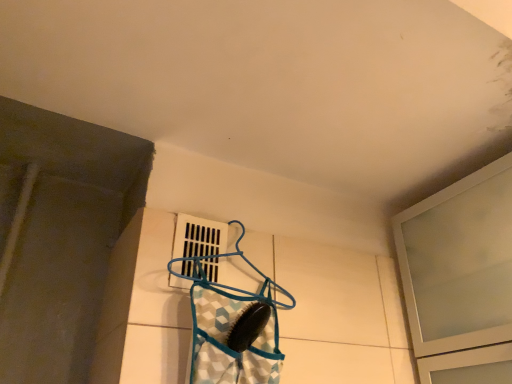
Question: Could blue fabric bag at center be considered to be inside white plastic vent at center, which is the 2th window in right-to-left order?

Choices:
 (A) yes
 (B) no

Answer: (B)

Question: From the image's perspective, would you say white plastic vent at center, which is the 2th window in right-to-left order, is positioned over blue fabric bag at center?

Choices:
 (A) no
 (B) yes

Answer: (B)

Question: Does white plastic vent at center, which is the 2th window in right-to-left order, come in front of blue fabric bag at center?

Choices:
 (A) no
 (B) yes

Answer: (A)

Question: Does white plastic vent at center, the 1th window viewed from the left, have a greater width compared to blue fabric bag at center?

Choices:
 (A) yes
 (B) no

Answer: (B)

Question: Is white plastic vent at center, which is the 2th window in right-to-left order, facing away from blue fabric bag at center?

Choices:
 (A) yes
 (B) no

Answer: (B)

Question: Considering the positions of blue plastic hanger at center and blue fabric bag at center in the image, is blue plastic hanger at center taller or shorter than blue fabric bag at center?

Choices:
 (A) short
 (B) tall

Answer: (B)

Question: Is blue plastic hanger at center inside or outside of blue fabric bag at center?

Choices:
 (A) outside
 (B) inside

Answer: (A)

Question: Considering their positions, is blue plastic hanger at center located in front of or behind blue fabric bag at center?

Choices:
 (A) front
 (B) behind

Answer: (B)

Question: From the image's perspective, is blue plastic hanger at center located above or below blue fabric bag at center?

Choices:
 (A) above
 (B) below

Answer: (A)

Question: From the image's perspective, is blue plastic hanger at center located above or below white plastic vent at center, the 1th window viewed from the left?

Choices:
 (A) above
 (B) below

Answer: (B)

Question: From a real-world perspective, relative to white plastic vent at center, the 1th window viewed from the left, is blue plastic hanger at center vertically above or below?

Choices:
 (A) above
 (B) below

Answer: (A)

Question: Considering the positions of point pyautogui.click(x=208, y=281) and point pyautogui.click(x=181, y=286), is point pyautogui.click(x=208, y=281) closer or farther from the camera than point pyautogui.click(x=181, y=286)?

Choices:
 (A) farther
 (B) closer

Answer: (A)

Question: Looking at the image, does blue plastic hanger at center seem bigger or smaller compared to white plastic vent at center, the 1th window viewed from the left?

Choices:
 (A) small
 (B) big

Answer: (B)

Question: Considering the positions of blue plastic hanger at center and frosted glass cabinet at upper right, the second window when ordered from left to right, in the image, is blue plastic hanger at center taller or shorter than frosted glass cabinet at upper right, the second window when ordered from left to right,?

Choices:
 (A) tall
 (B) short

Answer: (B)

Question: Is point pyautogui.click(x=234, y=244) positioned closer to the camera than point pyautogui.click(x=432, y=291)?

Choices:
 (A) closer
 (B) farther

Answer: (A)